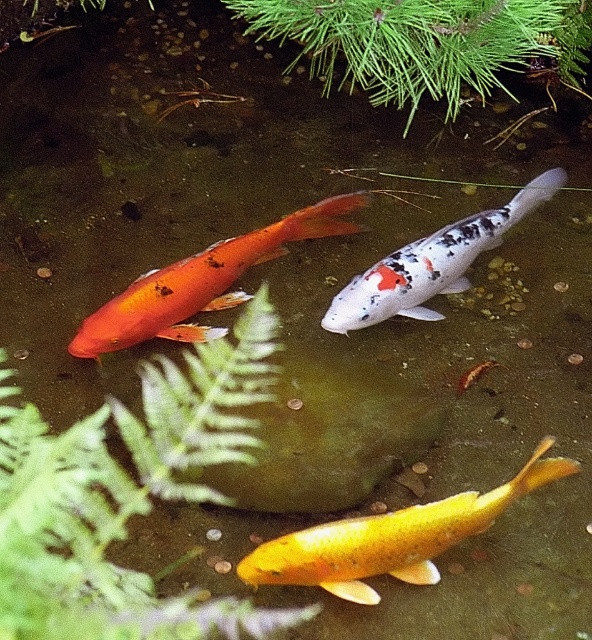
You are a small frog sitting on the green leafy fern at upper left and want to jump to the shiny orange fish at center. Do you think you can reach it with a single jump if your maximum jump distance is 8 inches?

The green leafy fern at upper left is 8.22 inches from the shiny orange fish at center. Since your maximum jump distance is 8 inches, you cannot reach the shiny orange fish at center in a single jump.

From the picture: You are a robotic fish in the pond and want to swim from your current position to the point at coordinates point (217, 262). However, there is an obstacle at point (12, 477). Since you can only move forward, will you encounter the obstacle before reaching your destination?

Point (12, 477) is in front of point (217, 262), so yes, the robotic fish will encounter the obstacle at point (12, 477) before reaching the destination at point (217, 262).